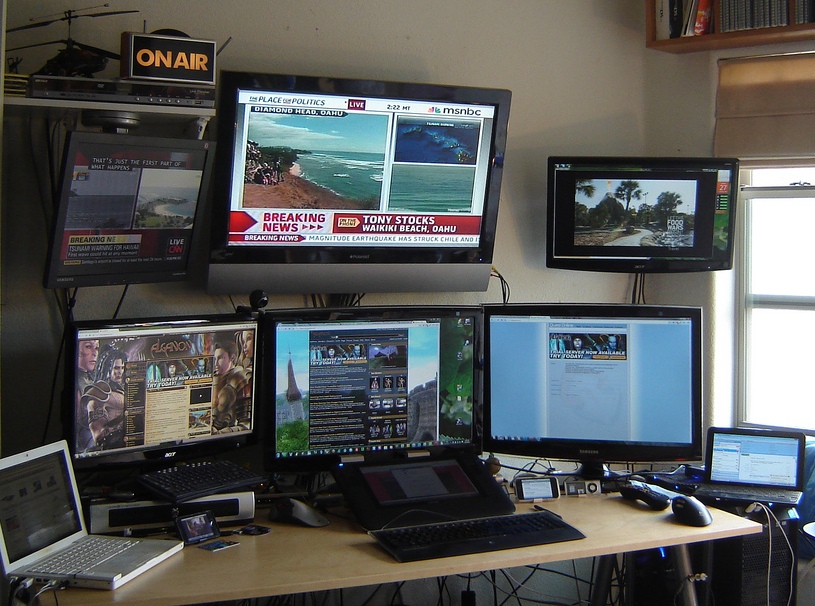
I want to click on mouse, so click(694, 510).